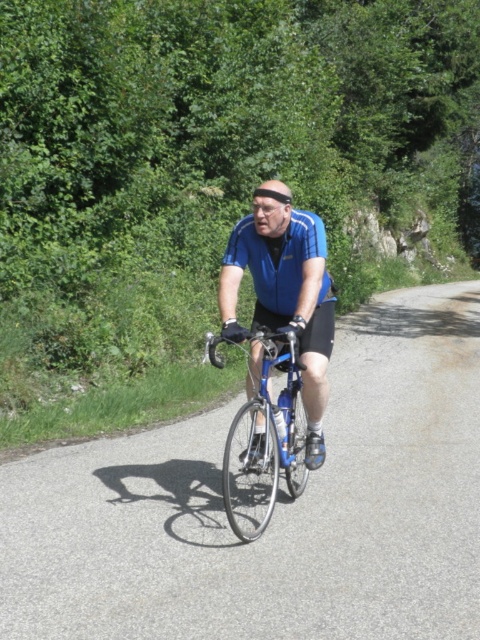
Question: Which point is farther to the camera?

Choices:
 (A) (228, 486)
 (B) (237, 240)
 (C) (470, 515)

Answer: (C)

Question: Which object is the closest to the blue matte jersey at center?

Choices:
 (A) asphalt road at center
 (B) shiny blue frame at center

Answer: (B)

Question: Is asphalt road at center smaller than blue matte jersey at center?

Choices:
 (A) yes
 (B) no

Answer: (B)

Question: Can you confirm if blue matte jersey at center is positioned to the right of shiny blue frame at center?

Choices:
 (A) yes
 (B) no

Answer: (A)

Question: Does blue matte jersey at center have a smaller size compared to shiny blue frame at center?

Choices:
 (A) yes
 (B) no

Answer: (B)

Question: Estimate the real-world distances between objects in this image. Which object is farther from the blue matte jersey at center?

Choices:
 (A) shiny blue frame at center
 (B) asphalt road at center

Answer: (B)